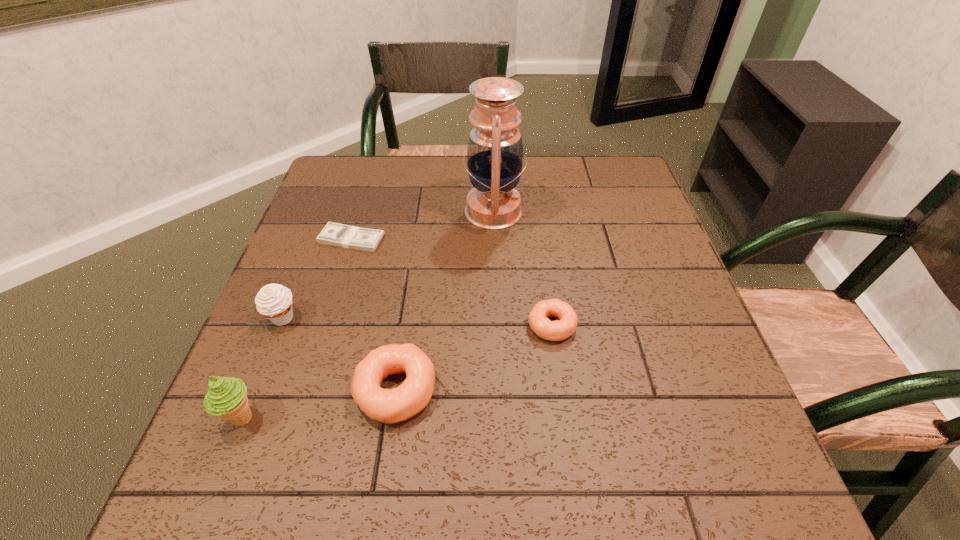
Find the location of a particular element. The image size is (960, 540). vacant space located on the front of the dollar is located at coordinates pos(318,349).

Locate an element on the screen. The height and width of the screenshot is (540, 960). vacant area situated 0.130m on the front of the oil lamp is located at coordinates (495, 275).

The height and width of the screenshot is (540, 960). Find the location of `vacant space positioned 0.130m on the back of the muffin`. vacant space positioned 0.130m on the back of the muffin is located at coordinates (304, 264).

In order to click on vacant space located on the right of the fifth shortest object in this screenshot , I will do `click(324, 418)`.

Where is `object positioned at the far edge`? The width and height of the screenshot is (960, 540). object positioned at the far edge is located at coordinates pos(495,153).

Where is `doughnut situated at the near edge`? Image resolution: width=960 pixels, height=540 pixels. doughnut situated at the near edge is located at coordinates (388, 406).

Locate an element on the screen. The width and height of the screenshot is (960, 540). icecream that is at the near edge is located at coordinates (226, 397).

You are a GUI agent. You are given a task and a screenshot of the screen. Output one action in this format:
    pyautogui.click(x=<x>, y=<y>)
    Task: Click on the dollar that is at the left edge
    
    Given the screenshot: What is the action you would take?
    pyautogui.click(x=334, y=234)

The width and height of the screenshot is (960, 540). Identify the location of muffin that is at the left edge. (274, 301).

This screenshot has height=540, width=960. Identify the location of icecream at the left edge. (226, 397).